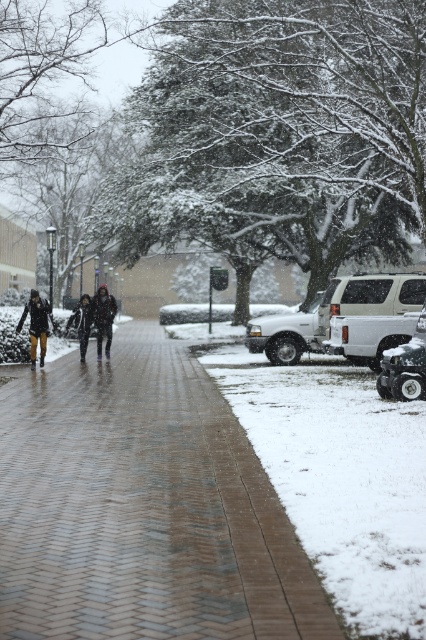
You are standing at the point marked by point (333,312) and want to walk to the snow covered ground in the foreground. Which direction should you go?

The snow covered ground in the foreground is located to the left of the white matte suv at right represented by point (333,312). So you should walk to the left.

You are a delivery person holding a package that needs to be placed between the dark gray wool coat at center and the dark gray fabric jacket at center. The package is 50 centimeters long. Is there enough space between them to place the package?

The distance between the dark gray wool coat at center and the dark gray fabric jacket at center is 45.16 centimeters. Since the package is 50 centimeters long, which is longer than the available space, the package cannot be placed between them.